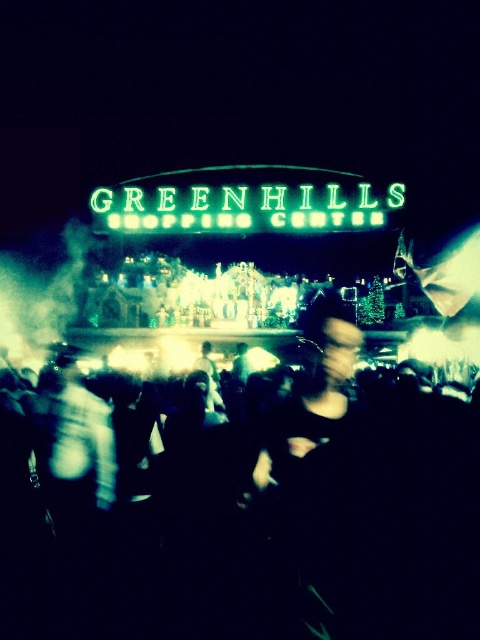
Question: Which point is closer to the camera?

Choices:
 (A) (405, 196)
 (B) (158, 548)

Answer: (B)

Question: Does black matte crowd at center have a larger size compared to neon green sign at center?

Choices:
 (A) yes
 (B) no

Answer: (A)

Question: Which point appears farthest from the camera in this image?

Choices:
 (A) (313, 412)
 (B) (130, 188)

Answer: (B)

Question: Which point is farther to the camera?

Choices:
 (A) (427, 604)
 (B) (105, 230)

Answer: (B)

Question: Can you confirm if black matte crowd at center is smaller than neon green sign at center?

Choices:
 (A) no
 (B) yes

Answer: (A)

Question: Is black matte crowd at center positioned at the back of neon green sign at center?

Choices:
 (A) yes
 (B) no

Answer: (B)